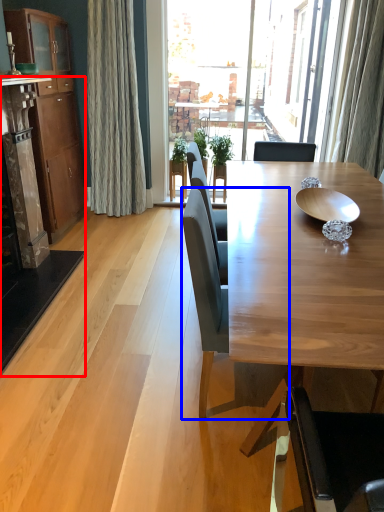
Question: Among these objects, which one is farthest to the camera, fireplace (highlighted by a red box) or chair (highlighted by a blue box)?

Choices:
 (A) fireplace
 (B) chair

Answer: (A)